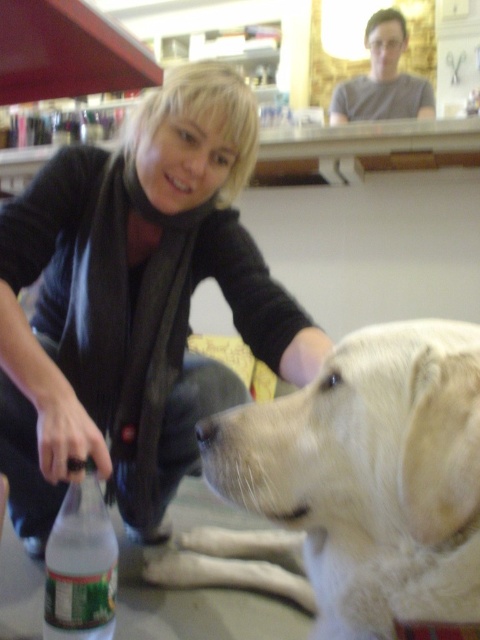
You are a pet sitter who needs to give the dog water. The white fur dog at lower center is thirsty and the green plastic bottle at lower left contains water. Can you reach the dog with the bottle without moving either of them?

The distance between the white fur dog at lower center and the green plastic bottle at lower left is 52.72 centimeters. Since the bottle is within reach for a typical person crouching, you can extend your arm to hand the water to the white fur dog at lower center without needing to move either object.

You are a photographer trying to capture a closeup of the white fur dog at lower center and the green plastic bottle at lower left. Given their sizes, which object will require a wider angle to fill the frame?

The white fur dog at lower center is larger in size than the green plastic bottle at lower left, so the white fur dog at lower center will require a wider angle to fill the frame.